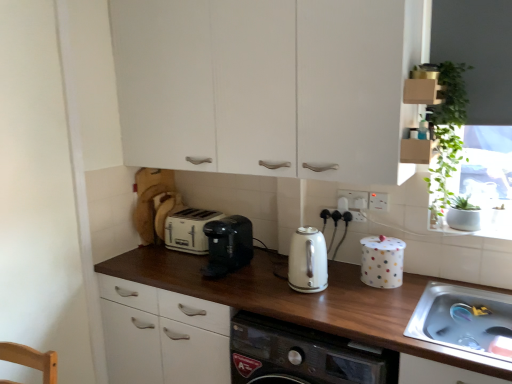
Question: Considering the relative sizes of black plastic coffee maker at center, the 1th kitchen appliance viewed from the left, and white polka dot canister at right in the image provided, is black plastic coffee maker at center, the 1th kitchen appliance viewed from the left, wider than white polka dot canister at right?

Choices:
 (A) yes
 (B) no

Answer: (A)

Question: Could white polka dot canister at right be considered to be inside black plastic coffee maker at center, the 1th kitchen appliance viewed from the left?

Choices:
 (A) yes
 (B) no

Answer: (B)

Question: Does black plastic coffee maker at center, the 1th kitchen appliance viewed from the left, appear on the left side of white polka dot canister at right?

Choices:
 (A) no
 (B) yes

Answer: (B)

Question: Could you tell me if black plastic coffee maker at center, the 1th kitchen appliance viewed from the left, is facing white polka dot canister at right?

Choices:
 (A) no
 (B) yes

Answer: (A)

Question: Is black plastic coffee maker at center, the 1th kitchen appliance viewed from the left, turned away from white polka dot canister at right?

Choices:
 (A) no
 (B) yes

Answer: (A)

Question: Considering the relative sizes of black plastic coffee maker at center, the 2th kitchen appliance when ordered from right to left, and white polka dot canister at right in the image provided, is black plastic coffee maker at center, the 2th kitchen appliance when ordered from right to left, thinner than white polka dot canister at right?

Choices:
 (A) no
 (B) yes

Answer: (A)

Question: From the image's perspective, is brown wood countertop at center located beneath black plastic coffee maker at center, the 1th kitchen appliance viewed from the left?

Choices:
 (A) yes
 (B) no

Answer: (A)

Question: Would you say brown wood countertop at center contains black plastic coffee maker at center, the 2th kitchen appliance when ordered from right to left?

Choices:
 (A) no
 (B) yes

Answer: (A)

Question: Does brown wood countertop at center have a smaller size compared to black plastic coffee maker at center, the 2th kitchen appliance when ordered from right to left?

Choices:
 (A) yes
 (B) no

Answer: (B)

Question: Is brown wood countertop at center at the right side of black plastic coffee maker at center, the 1th kitchen appliance viewed from the left?

Choices:
 (A) yes
 (B) no

Answer: (A)

Question: Is brown wood countertop at center positioned with its back to black plastic coffee maker at center, the 2th kitchen appliance when ordered from right to left?

Choices:
 (A) no
 (B) yes

Answer: (A)

Question: Can you confirm if brown wood countertop at center is taller than black plastic coffee maker at center, the 2th kitchen appliance when ordered from right to left?

Choices:
 (A) yes
 (B) no

Answer: (A)